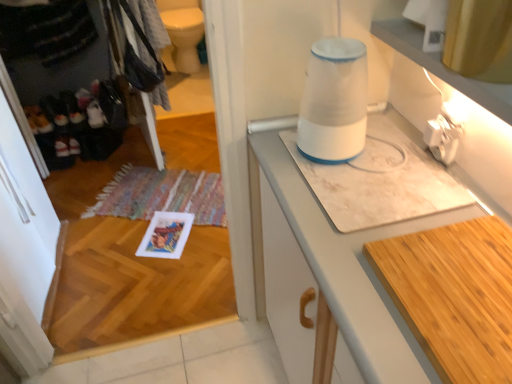
The image size is (512, 384). Find the location of `white marble countertop at center`. white marble countertop at center is located at coordinates 328,275.

Where is `white plastic blender at upper center`? The height and width of the screenshot is (384, 512). white plastic blender at upper center is located at coordinates (334, 102).

The height and width of the screenshot is (384, 512). Identify the location of white marble countertop at center. (328, 275).

Is white marble countertop at center outside of wooden cutting board at lower right?

That's correct, white marble countertop at center is outside of wooden cutting board at lower right.

Where is `cabinetry located on the left of wooden cutting board at lower right`? cabinetry located on the left of wooden cutting board at lower right is located at coordinates (328, 275).

Considering the sizes of objects white marble countertop at center and wooden cutting board at lower right in the image provided, who is smaller, white marble countertop at center or wooden cutting board at lower right?

Smaller between the two is wooden cutting board at lower right.

How distant is white marble countertop at center from wooden cutting board at lower right?

white marble countertop at center is 7.11 inches away from wooden cutting board at lower right.

Does wooden cutting board at lower right turn towards white marble countertop at center?

Yes, wooden cutting board at lower right is aimed at white marble countertop at center.

Between wooden cutting board at lower right and white marble countertop at center, which one appears on the left side from the viewer's perspective?

From the viewer's perspective, white marble countertop at center appears more on the left side.

Is the position of wooden cutting board at lower right less distant than that of white marble countertop at center?

Yes, wooden cutting board at lower right is closer to the camera.

Considering the sizes of wooden cutting board at lower right and white marble countertop at center in the image, is wooden cutting board at lower right bigger or smaller than white marble countertop at center?

Clearly, wooden cutting board at lower right is smaller in size than white marble countertop at center.

Is white plastic blender at upper center in front of wooden cutting board at lower right?

No.

Is white plastic blender at upper center to the left or to the right of wooden cutting board at lower right in the image?

In the image, white plastic blender at upper center appears on the left side of wooden cutting board at lower right.

From the picture: From a real-world perspective, is white plastic blender at upper center on top of wooden cutting board at lower right?

Yes.

Is wooden cutting board at lower right facing away from white plastic blender at upper center?

No.

Does wooden cutting board at lower right contain white plastic blender at upper center?

No, wooden cutting board at lower right does not contain white plastic blender at upper center.

Is wooden cutting board at lower right next to white plastic blender at upper center?

No.

The width and height of the screenshot is (512, 384). In order to click on countertop lying below the white plastic blender at upper center (from the image's perspective) in this screenshot , I will do `click(454, 295)`.

Between white marble countertop at center and multicolored woven mat at lower left, which one has smaller size?

Smaller between the two is multicolored woven mat at lower left.

From a real-world perspective, who is located lower, white marble countertop at center or multicolored woven mat at lower left?

multicolored woven mat at lower left.

Is the surface of white marble countertop at center in direct contact with multicolored woven mat at lower left?

No.

Is white marble countertop at center facing towards multicolored woven mat at lower left?

No, white marble countertop at center does not turn towards multicolored woven mat at lower left.

Which object is thinner, wooden cutting board at lower right or multicolored woven mat at lower left?

wooden cutting board at lower right is thinner.

Does wooden cutting board at lower right have a greater height compared to multicolored woven mat at lower left?

Incorrect, the height of wooden cutting board at lower right is not larger of that of multicolored woven mat at lower left.

Where is `countertop positioned vertically above the multicolored woven mat at lower left (from a real-world perspective)`? The image size is (512, 384). countertop positioned vertically above the multicolored woven mat at lower left (from a real-world perspective) is located at coordinates pos(454,295).

Does wooden cutting board at lower right turn towards multicolored woven mat at lower left?

No, wooden cutting board at lower right does not turn towards multicolored woven mat at lower left.

I want to click on mat located below the white plastic blender at upper center (from the image's perspective), so click(162, 195).

Does white plastic blender at upper center lie behind multicolored woven mat at lower left?

No, white plastic blender at upper center is in front of multicolored woven mat at lower left.

Does white plastic blender at upper center have a smaller size compared to multicolored woven mat at lower left?

Correct, white plastic blender at upper center occupies less space than multicolored woven mat at lower left.

Is white plastic blender at upper center aimed at multicolored woven mat at lower left?

No, white plastic blender at upper center is not oriented towards multicolored woven mat at lower left.

The width and height of the screenshot is (512, 384). In order to click on countertop that is above the white marble countertop at center (from a real-world perspective) in this screenshot , I will do `click(454, 295)`.

The height and width of the screenshot is (384, 512). In order to click on countertop in front of the white marble countertop at center in this screenshot , I will do `click(454, 295)`.

Considering their positions, is wooden cutting board at lower right positioned further to white plastic blender at upper center than white marble countertop at center?

wooden cutting board at lower right is further to white plastic blender at upper center.

Which object lies nearer to the anchor point wooden cutting board at lower right, white plastic blender at upper center or multicolored woven mat at lower left?

white plastic blender at upper center.

From the image, which object appears to be nearer to white plastic blender at upper center, white marble countertop at center or wooden cutting board at lower right?

Among the two, white marble countertop at center is located nearer to white plastic blender at upper center.

From the image, which object appears to be farther from multicolored woven mat at lower left, white marble countertop at center or wooden cutting board at lower right?

Among the two, wooden cutting board at lower right is located further to multicolored woven mat at lower left.

When comparing their distances from multicolored woven mat at lower left, does wooden cutting board at lower right or white plastic blender at upper center seem closer?

white plastic blender at upper center is positioned closer to the anchor multicolored woven mat at lower left.

From the image, which object appears to be nearer to white plastic blender at upper center, wooden cutting board at lower right or multicolored woven mat at lower left?

wooden cutting board at lower right.

Considering their positions, is white marble countertop at center positioned closer to multicolored woven mat at lower left than white plastic blender at upper center?

white marble countertop at center.

Based on their spatial positions, is multicolored woven mat at lower left or white marble countertop at center further from white plastic blender at upper center?

multicolored woven mat at lower left is further to white plastic blender at upper center.

I want to click on cabinetry between wooden cutting board at lower right and multicolored woven mat at lower left from front to back, so click(x=328, y=275).

I want to click on countertop between white plastic blender at upper center and white marble countertop at center vertically, so click(x=454, y=295).

I want to click on blender located between wooden cutting board at lower right and multicolored woven mat at lower left in the depth direction, so click(x=334, y=102).

Where is `blender between white marble countertop at center and multicolored woven mat at lower left along the z-axis`? The width and height of the screenshot is (512, 384). blender between white marble countertop at center and multicolored woven mat at lower left along the z-axis is located at coordinates (334, 102).